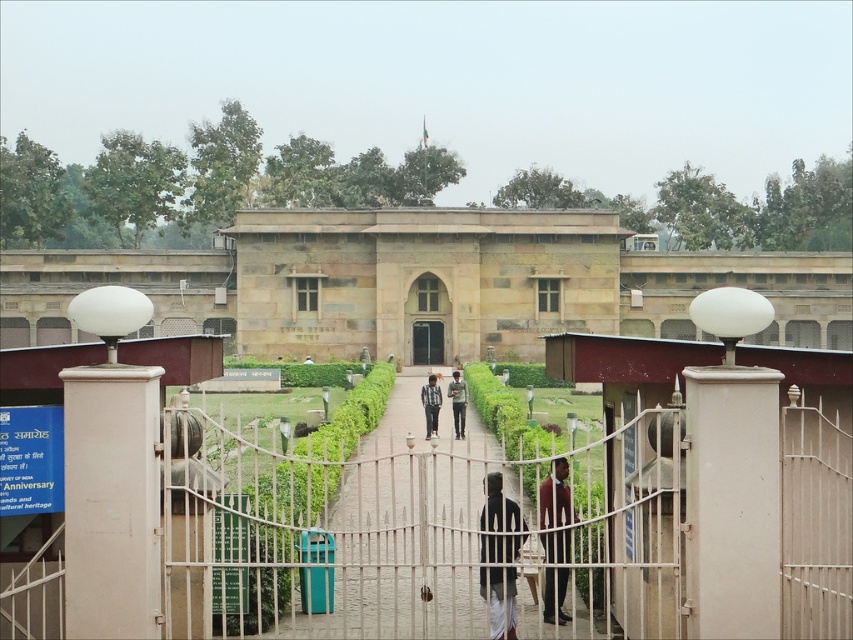
Is stone/rough stone building at center bigger than green fabric shirt at center?

Correct, stone/rough stone building at center is larger in size than green fabric shirt at center.

Which is behind, point (123, 280) or point (451, 374)?

Point (123, 280)

Identify the location of stone/rough stone building at center. (424, 284).

Which is in front, point (511, 515) or point (428, 344)?

Positioned in front is point (511, 515).

Is dark gray fabric at center wider than dark glass door at center?

In fact, dark gray fabric at center might be narrower than dark glass door at center.

Image resolution: width=853 pixels, height=640 pixels. What do you see at coordinates (498, 508) in the screenshot? I see `dark gray fabric at center` at bounding box center [498, 508].

At what (x,y) coordinates should I click in order to perform the action: click on dark gray fabric at center. Please return your answer as a coordinate pair (x, y). Looking at the image, I should click on (498, 508).

Between dark gray fabric at center and green fabric shirt at center, which one has less height?

With less height is dark gray fabric at center.

Does dark gray fabric at center have a smaller size compared to green fabric shirt at center?

Yes.

The width and height of the screenshot is (853, 640). What are the coordinates of `dark gray fabric at center` in the screenshot? It's located at (498, 508).

Locate an element on the screen. dark gray fabric at center is located at coordinates (498, 508).